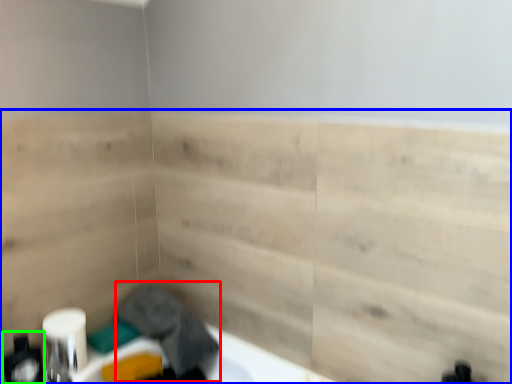
Question: Estimate the real-world distances between objects in this image. Which object is closer to laundry (highlighted by a red box), plywood (highlighted by a blue box) or toiletry (highlighted by a green box)?

Choices:
 (A) plywood
 (B) toiletry

Answer: (A)